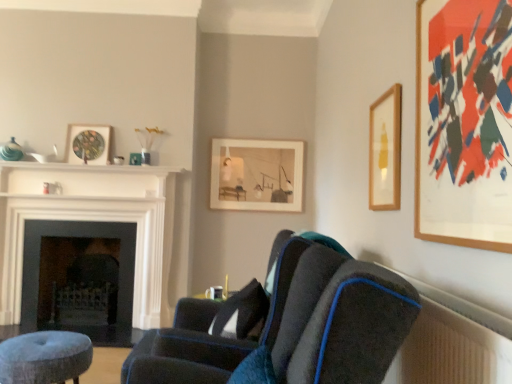
The width and height of the screenshot is (512, 384). Identify the location of free point above matte glass picture frame at upper left, which is the first picture frame from left to right (from a real-world perspective). (89, 126).